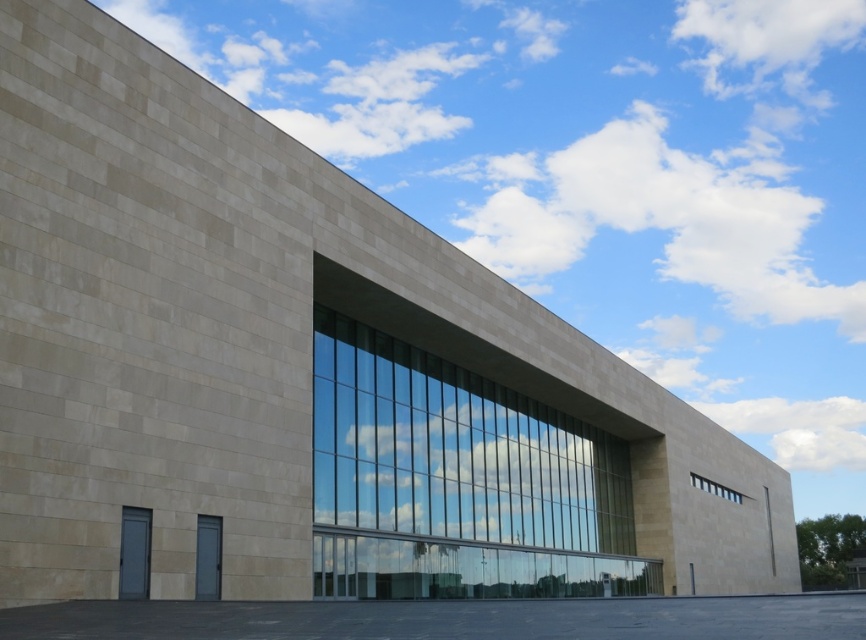
Question: Does transparent glass window at center have a larger size compared to clear glass window at upper center?

Choices:
 (A) yes
 (B) no

Answer: (A)

Question: Is transparent glass window at center smaller than clear glass window at upper center?

Choices:
 (A) no
 (B) yes

Answer: (A)

Question: Among these objects, which one is nearest to the camera?

Choices:
 (A) transparent glass window at center
 (B) clear glass window at upper center

Answer: (A)

Question: Which point appears closest to the camera in this image?

Choices:
 (A) (328, 497)
 (B) (706, 486)

Answer: (A)

Question: Considering the relative positions of transparent glass window at center and clear glass window at upper center in the image provided, where is transparent glass window at center located with respect to clear glass window at upper center?

Choices:
 (A) left
 (B) right

Answer: (A)